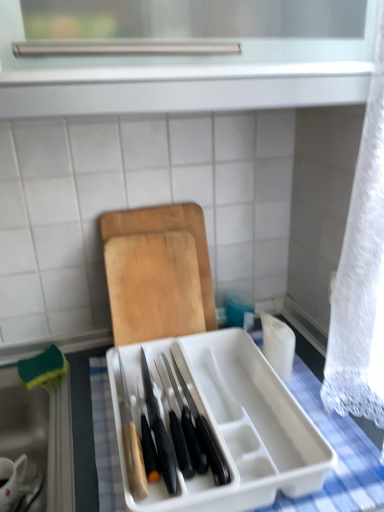
Question: Considering the relative positions of wooden cutting board at center and white ceramic mug at lower left in the image provided, is wooden cutting board at center to the left or to the right of white ceramic mug at lower left?

Choices:
 (A) right
 (B) left

Answer: (A)

Question: From the image's perspective, is wooden cutting board at center positioned above or below white ceramic mug at lower left?

Choices:
 (A) above
 (B) below

Answer: (A)

Question: Which object is the farthest from the white plastic knife block at center?

Choices:
 (A) wooden cutting board at center
 (B) white ceramic mug at lower left

Answer: (B)

Question: Which of these objects is positioned closest to the white plastic knife block at center?

Choices:
 (A) wooden cutting board at center
 (B) white ceramic mug at lower left

Answer: (A)